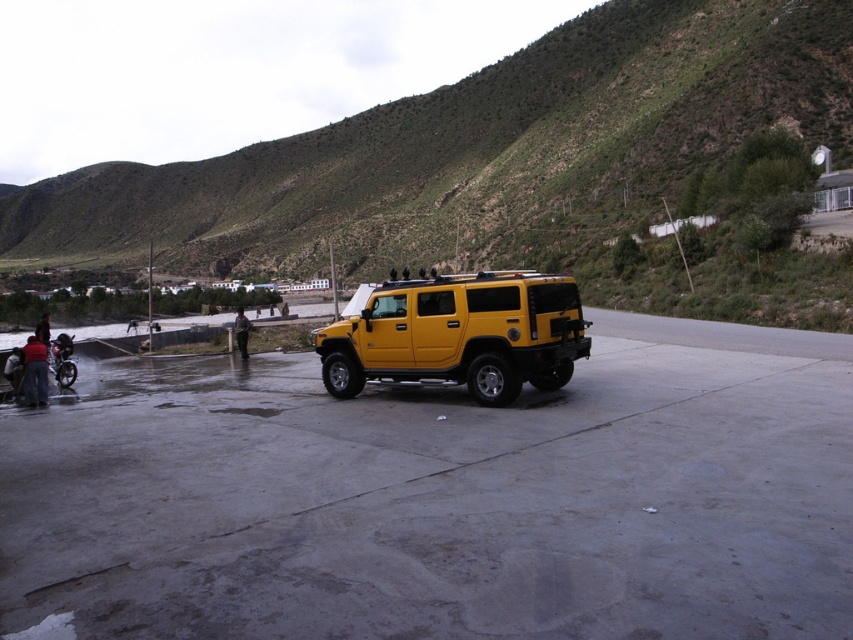
You are standing at the center of the image. Which direction should you walk to reach the metallic silver motorcycle at lower left?

You should walk towards the lower left direction to reach the metallic silver motorcycle at lower left.

You are standing at the entrance of the village and see the metallic silver motorcycle at lower left and the dark brown leather jacket at lower left. Which object is closer to you?

The metallic silver motorcycle at lower left is closer to you because it is positioned further to the viewer than the dark brown leather jacket at lower left.